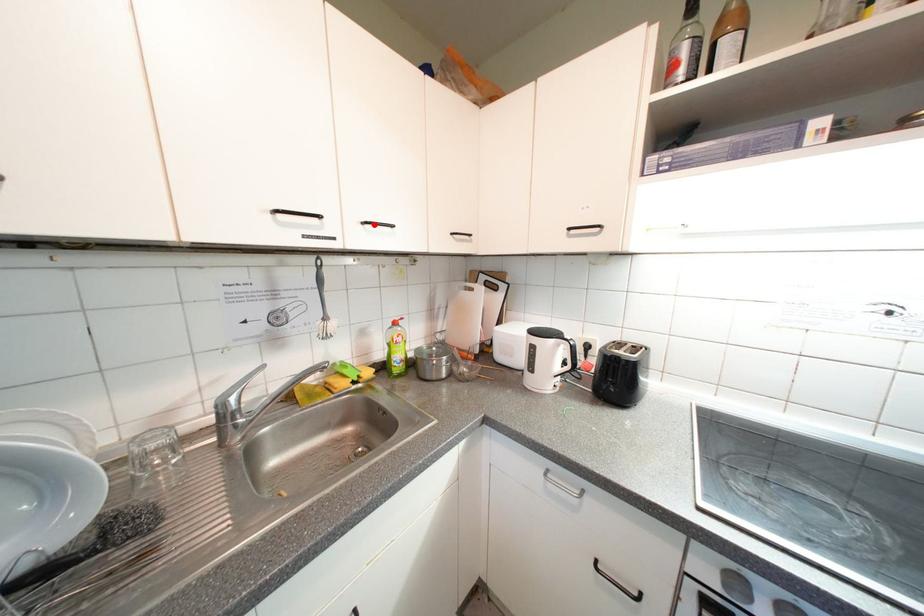
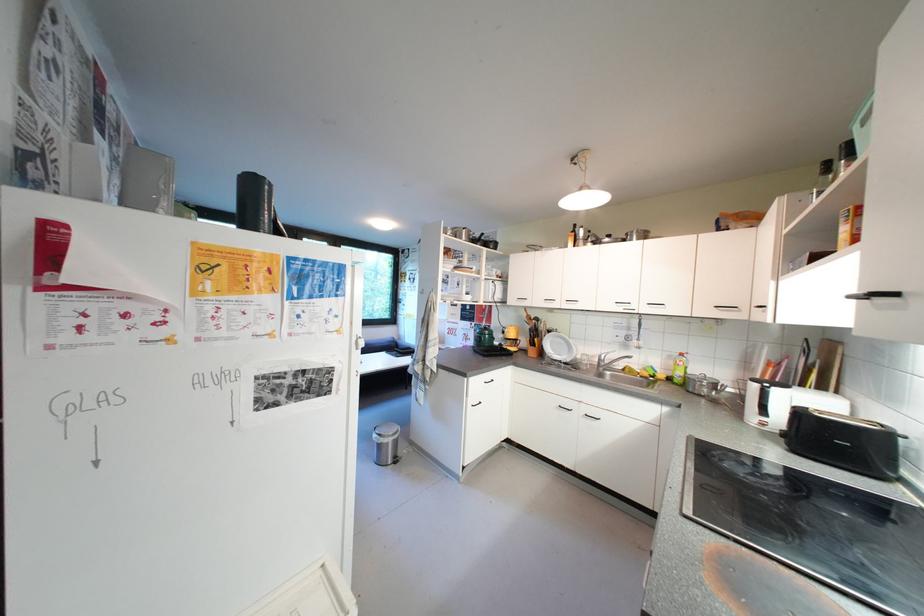
The point at the highlighted location is marked in the first image. Where is the corresponding point in the second image?

(657, 306)